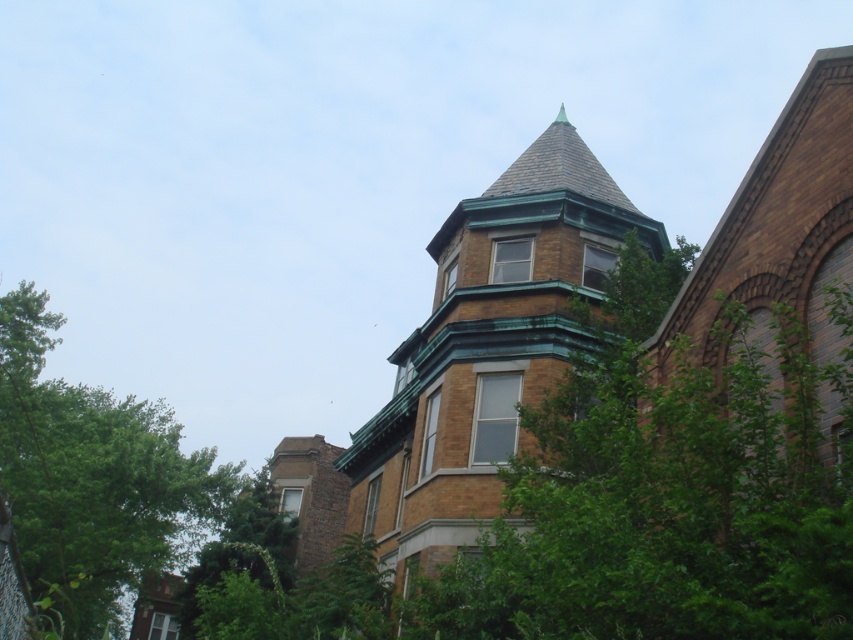
Which of these two, brown brick tower at center or green leafy tree at left, stands taller?

green leafy tree at left

Which is more to the right, brown brick tower at center or green leafy tree at left?

Positioned to the right is brown brick tower at center.

Identify the location of brown brick tower at center. The image size is (853, 640). (488, 348).

Locate an element on the screen. The image size is (853, 640). brown brick tower at center is located at coordinates (488, 348).